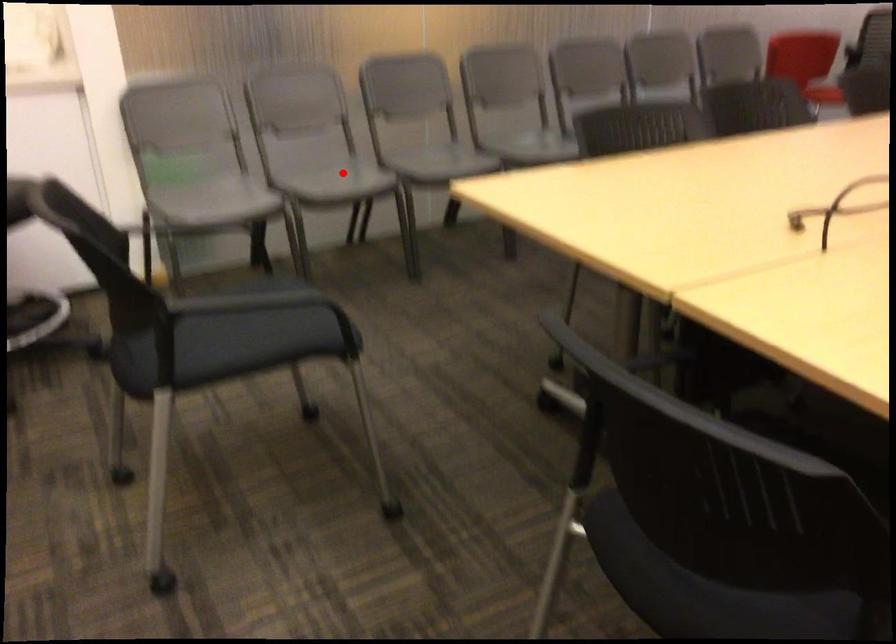
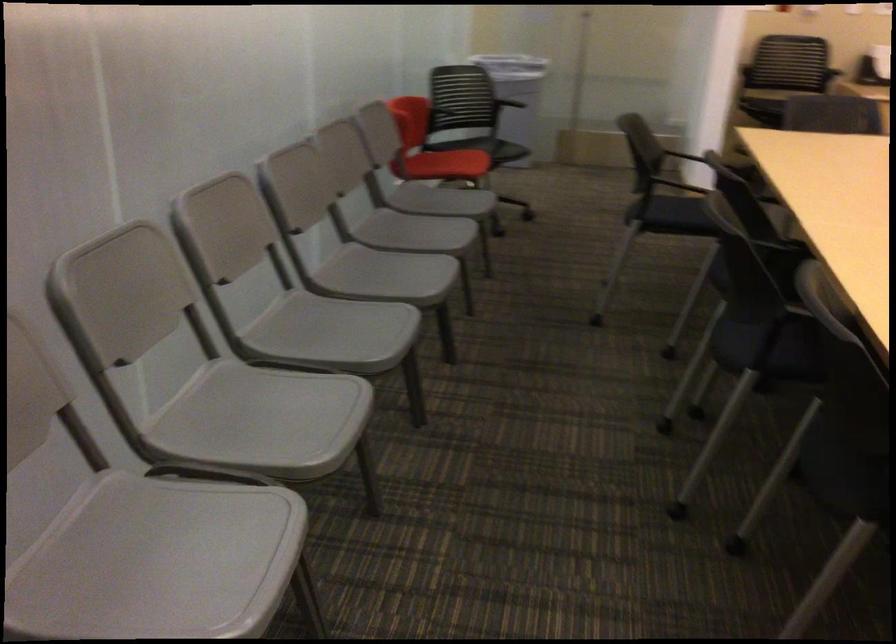
Locate, in the second image, the point that corresponds to the highlighted location in the first image.

(158, 561)